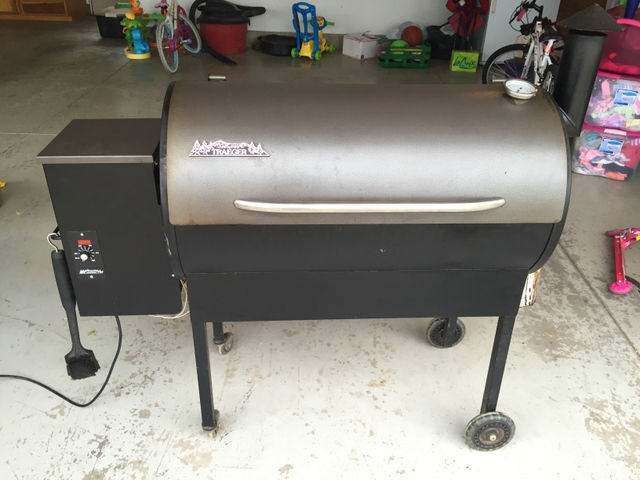
Find the location of a particular element. This screenshot has height=480, width=640. cable is located at coordinates (70, 399).